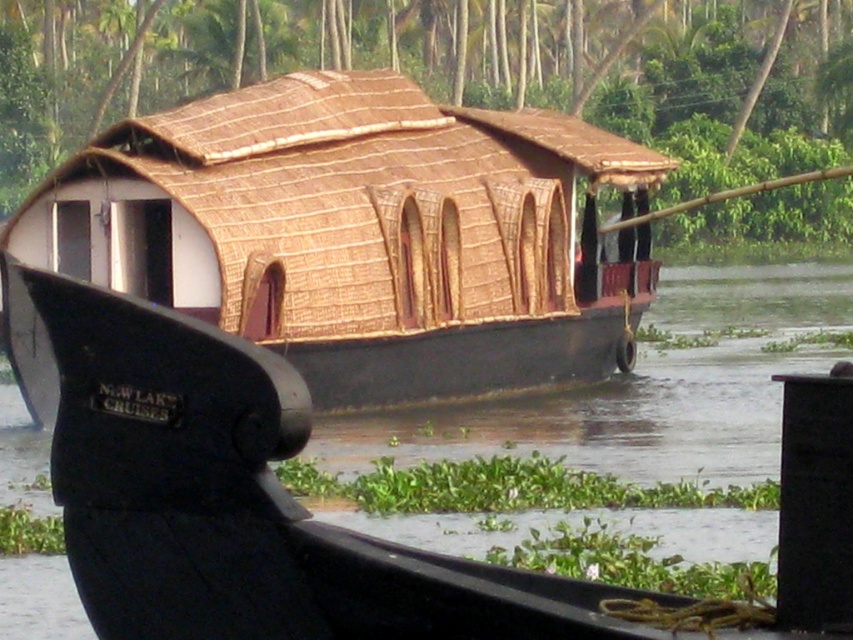
You are planning to board a traditional kettuvallam houseboat. You see the brown thatched roof houseboat at center and the brown thatch roof at center. Which one is narrower?

The brown thatched roof houseboat at center is narrower than the brown thatch roof at center.

You are on a tour boat named NEW LAKE CRUISES and want to observe the brown thatched roof houseboat at center from above. Can you do so by standing on the brown thatch roof at center of your boat?

The brown thatched roof houseboat at center is below the brown thatch roof at center of your boat, so yes, you can observe it from above by standing there.

You are on a tour boat named NEW LAKE CRUISES and see two brown thatch roofs ahead. The first is labeled as the brown thatched roof houseboat at center, and the second is the brown thatch roof at center. Which one is positioned to the left?

The brown thatched roof houseboat at center is positioned to the left of the brown thatch roof at center.